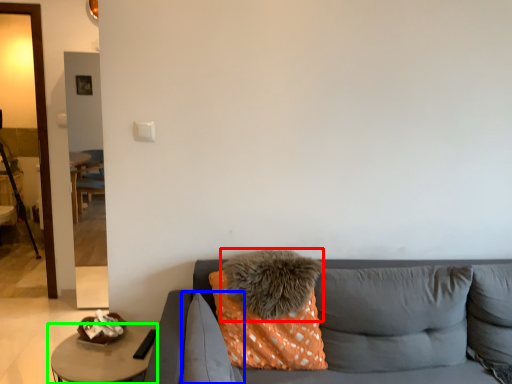
Question: Which is nearer to the pillow (highlighted by a red box)? pillow (highlighted by a blue box) or table (highlighted by a green box).

Choices:
 (A) pillow
 (B) table

Answer: (A)